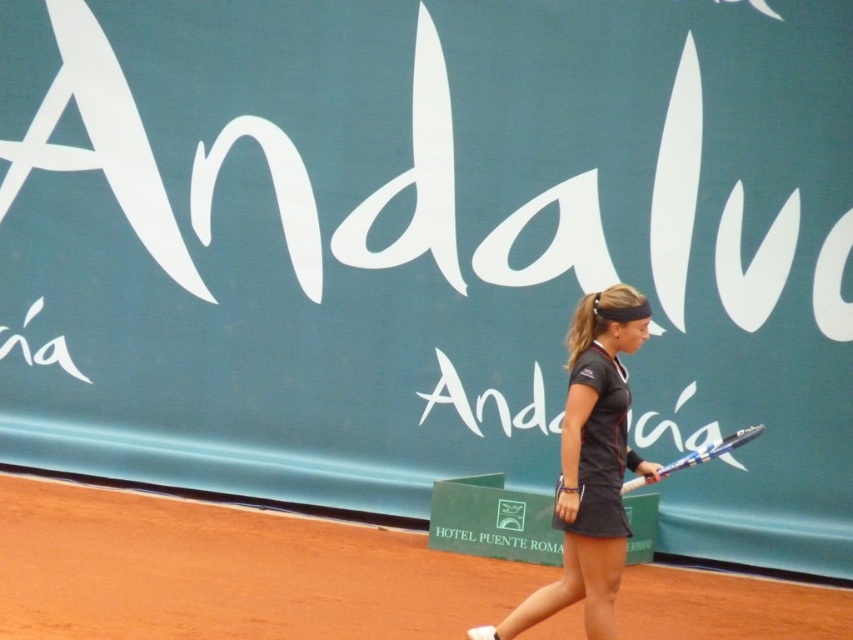
Who is higher up, brown clay tennis court at center or dark gray fabric tennis outfit at center?

dark gray fabric tennis outfit at center

From the picture: Is brown clay tennis court at center smaller than dark gray fabric tennis outfit at center?

Yes, brown clay tennis court at center is smaller than dark gray fabric tennis outfit at center.

Which is behind, point (757, 579) or point (598, 614)?

Positioned behind is point (757, 579).

Image resolution: width=853 pixels, height=640 pixels. Find the location of `brown clay tennis court at center`. brown clay tennis court at center is located at coordinates (227, 572).

Can you confirm if dark gray fabric tennis outfit at center is bigger than blue metallic racket at center?

Yes.

The height and width of the screenshot is (640, 853). I want to click on dark gray fabric tennis outfit at center, so click(x=590, y=467).

Find the location of a particular element. dark gray fabric tennis outfit at center is located at coordinates [590, 467].

Does brown clay tennis court at center appear under blue metallic racket at center?

Indeed, brown clay tennis court at center is positioned under blue metallic racket at center.

Is brown clay tennis court at center smaller than blue metallic racket at center?

No, brown clay tennis court at center is not smaller than blue metallic racket at center.

Where is `brown clay tennis court at center`? The image size is (853, 640). brown clay tennis court at center is located at coordinates (227, 572).